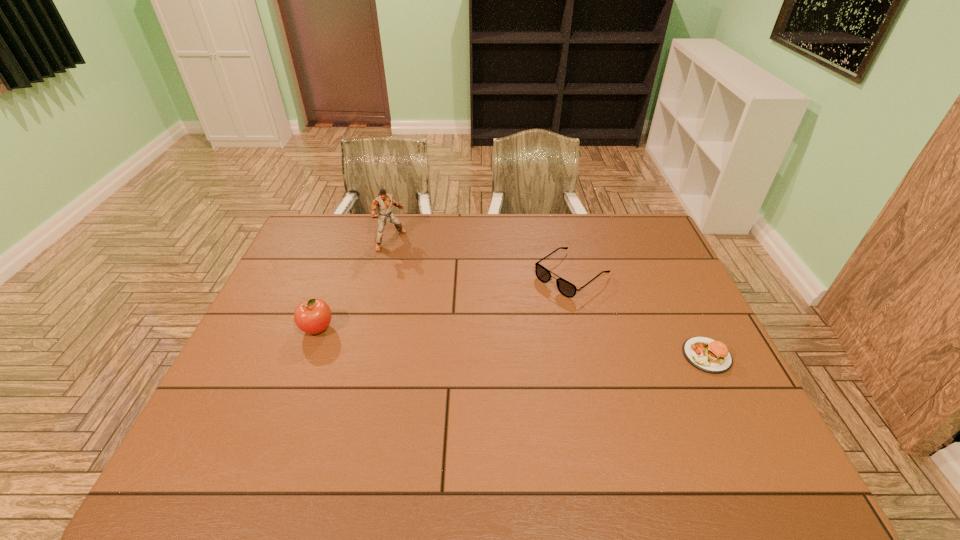
Where is `free space between the apple and the patty`? free space between the apple and the patty is located at coordinates (512, 342).

What are the coordinates of `free area in between the third shortest object and the rightmost object` in the screenshot? It's located at (512, 342).

Where is `free point between the rightmost object and the second tallest object`? The height and width of the screenshot is (540, 960). free point between the rightmost object and the second tallest object is located at coordinates (512, 342).

What are the coordinates of `free spot between the apple and the puncher` in the screenshot? It's located at (354, 284).

I want to click on vacant point located between the rightmost object and the spectacles, so click(x=639, y=315).

Where is `free space that is in between the second object from right to left and the leftmost object`? free space that is in between the second object from right to left and the leftmost object is located at coordinates (444, 301).

Where is `vacant space that's between the second object from left to right and the leftmost object`? vacant space that's between the second object from left to right and the leftmost object is located at coordinates (354, 284).

Where is `object that is the closest one to the leftmost object`? object that is the closest one to the leftmost object is located at coordinates (383, 202).

Identify which object is located as the third nearest to the third object from right to left. Please provide its 2D coordinates. Your answer should be formatted as a tuple, i.e. [(x, y)], where the tuple contains the x and y coordinates of a point satisfying the conditions above.

[(711, 356)]

Find the location of a particular element. vacant region that satisfies the following two spatial constraints: 1. on the front side of the shortest object; 2. on the right side of the tallest object is located at coordinates pyautogui.click(x=363, y=355).